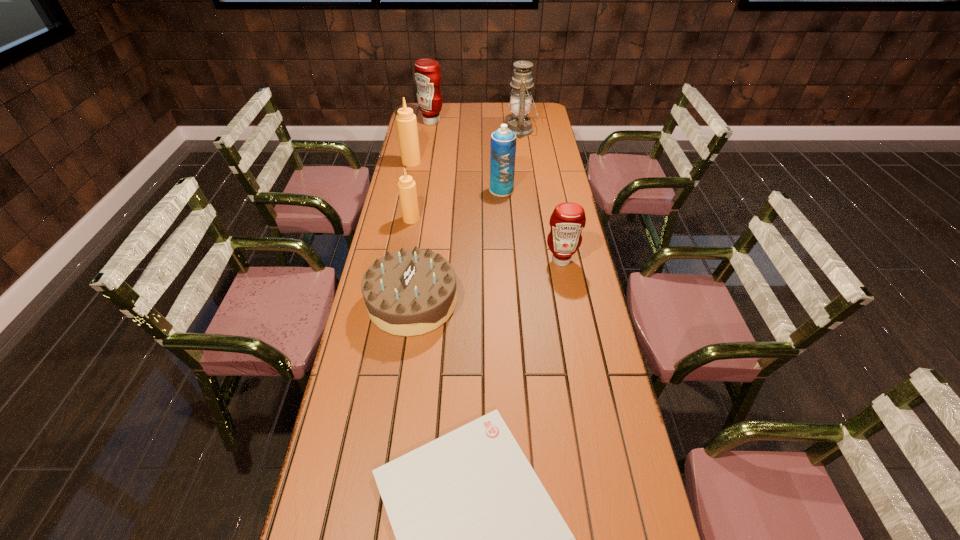
At what (x,y) coordinates should I click in order to perform the action: click on condiment that is at the far edge. Please return your answer as a coordinate pair (x, y). The width and height of the screenshot is (960, 540). Looking at the image, I should click on (427, 74).

Locate an element on the screen. birthday cake that is at the left edge is located at coordinates (409, 292).

Identify the location of oil lamp located in the right edge section of the desktop. Image resolution: width=960 pixels, height=540 pixels. (520, 102).

Image resolution: width=960 pixels, height=540 pixels. I want to click on condiment at the right edge, so click(x=568, y=219).

This screenshot has width=960, height=540. In order to click on object that is positioned at the far left corner in this screenshot , I will do `click(427, 74)`.

You are a GUI agent. You are given a task and a screenshot of the screen. Output one action in this format:
    pyautogui.click(x=<x>, y=<y>)
    Task: Click on the object located in the far right corner section of the desktop
    Image resolution: width=960 pixels, height=540 pixels.
    Given the screenshot: What is the action you would take?
    pyautogui.click(x=520, y=102)

Where is `free location at the far edge`? The height and width of the screenshot is (540, 960). free location at the far edge is located at coordinates (497, 103).

In order to click on vacant area at the left edge in this screenshot , I will do `click(383, 339)`.

In the image, there is a desktop. At what (x,y) coordinates should I click in order to perform the action: click on vacant space at the right edge. Please return your answer as a coordinate pair (x, y). The width and height of the screenshot is (960, 540). Looking at the image, I should click on (538, 200).

The width and height of the screenshot is (960, 540). In order to click on empty location between the second nearest condiment and the left red condiment in this screenshot , I will do `click(421, 171)`.